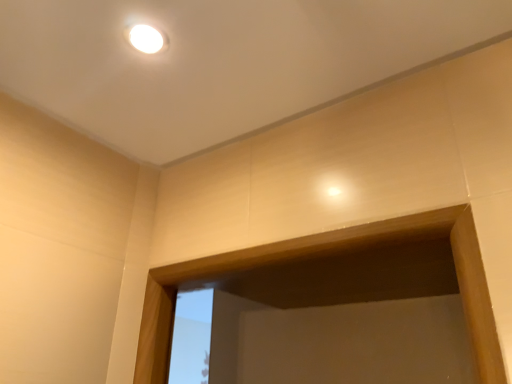
At what (x,y) coordinates should I click in order to perform the action: click on wooden frame at center. Please return your answer as a coordinate pair (x, y). Looking at the image, I should click on [327, 256].

What do you see at coordinates (327, 256) in the screenshot? The image size is (512, 384). I see `wooden frame at center` at bounding box center [327, 256].

In order to click on wooden frame at center in this screenshot , I will do `click(327, 256)`.